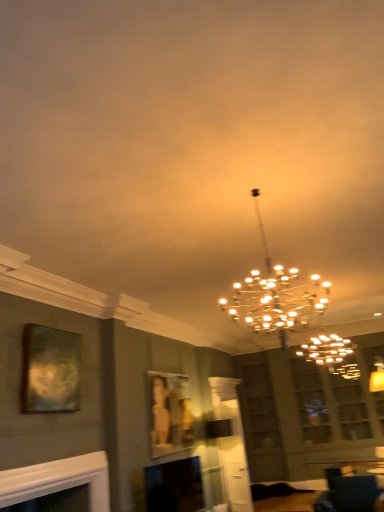
Question: Does metallic gold picture frame at upper left, which is the 1th picture frame in top-to-bottom order, have a lesser height compared to matte gold picture frame at center, acting as the first picture frame starting from the right?

Choices:
 (A) no
 (B) yes

Answer: (B)

Question: Considering the relative sizes of metallic gold picture frame at upper left, placed as the 2th picture frame when sorted from back to front, and matte gold picture frame at center, the first picture frame when ordered from back to front, in the image provided, is metallic gold picture frame at upper left, placed as the 2th picture frame when sorted from back to front, taller than matte gold picture frame at center, the first picture frame when ordered from back to front,?

Choices:
 (A) yes
 (B) no

Answer: (B)

Question: Can you confirm if metallic gold picture frame at upper left, the second picture frame in the bottom-to-top sequence, is positioned to the left of matte gold picture frame at center, positioned as the second picture frame in front-to-back order?

Choices:
 (A) yes
 (B) no

Answer: (A)

Question: Are metallic gold picture frame at upper left, positioned as the second picture frame in right-to-left order, and matte gold picture frame at center, which appears as the second picture frame when viewed from the top, located far from each other?

Choices:
 (A) no
 (B) yes

Answer: (B)

Question: Is matte gold picture frame at center, the first picture frame when ordered from back to front, surrounded by metallic gold picture frame at upper left, positioned as the second picture frame in right-to-left order?

Choices:
 (A) yes
 (B) no

Answer: (B)

Question: Is metallic gold picture frame at upper left, the second picture frame in the bottom-to-top sequence, at the right side of matte gold picture frame at center, positioned as the second picture frame in front-to-back order?

Choices:
 (A) yes
 (B) no

Answer: (B)

Question: Is matte gold picture frame at center, the first picture frame when ordered from back to front, not close to velvet dark blue sofa at lower right?

Choices:
 (A) no
 (B) yes

Answer: (B)

Question: From a real-world perspective, is matte gold picture frame at center, positioned as the second picture frame in front-to-back order, over velvet dark blue sofa at lower right?

Choices:
 (A) no
 (B) yes

Answer: (B)

Question: Is matte gold picture frame at center, the 2th picture frame from the left, to the left of velvet dark blue sofa at lower right from the viewer's perspective?

Choices:
 (A) no
 (B) yes

Answer: (B)

Question: From the image's perspective, is matte gold picture frame at center, acting as the first picture frame starting from the right, below velvet dark blue sofa at lower right?

Choices:
 (A) no
 (B) yes

Answer: (A)

Question: Does matte gold picture frame at center, positioned as the second picture frame in front-to-back order, turn towards velvet dark blue sofa at lower right?

Choices:
 (A) yes
 (B) no

Answer: (A)

Question: Considering the relative sizes of matte gold picture frame at center, placed as the first picture frame when sorted from bottom to top, and velvet dark blue sofa at lower right in the image provided, is matte gold picture frame at center, placed as the first picture frame when sorted from bottom to top, smaller than velvet dark blue sofa at lower right?

Choices:
 (A) no
 (B) yes

Answer: (B)

Question: From the image's perspective, is white glossy fireplace at lower left, the second fireplace viewed from the back, under metallic gold chandelier at center?

Choices:
 (A) yes
 (B) no

Answer: (A)